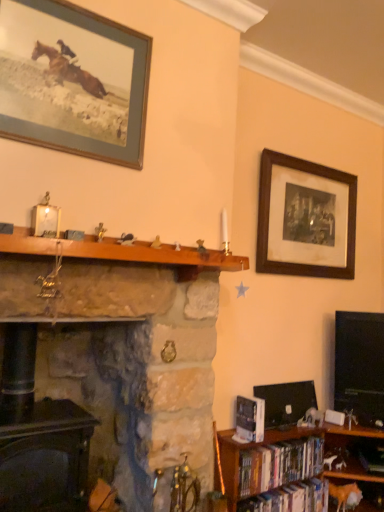
Question: In the image, is dark wood fireplace at lower left, positioned as the second fireplace in right-to-left order, positioned in front of or behind wooden bookshelf at lower right?

Choices:
 (A) front
 (B) behind

Answer: (B)

Question: Considering the relative positions of dark wood fireplace at lower left, positioned as the second fireplace in right-to-left order, and wooden bookshelf at lower right in the image provided, is dark wood fireplace at lower left, positioned as the second fireplace in right-to-left order, to the left or to the right of wooden bookshelf at lower right?

Choices:
 (A) right
 (B) left

Answer: (B)

Question: Which of these objects is positioned closest to the white glossy bookshelf at lower right, placed as the third book when sorted from bottom to top?

Choices:
 (A) wooden picture frame at upper right, the 1th picture frame in the right-to-left sequence
 (B) hardcover books at lower right, which ranks as the first book in bottom-to-top order
 (C) blue matte picture frame at upper left, which is counted as the 1th picture frame, starting from the left
 (D) dark wood fireplace at lower left, acting as the first fireplace starting from the left
 (E) wooden at center

Answer: (B)

Question: Estimate the real-world distances between objects in this image. Which object is farther from the wooden picture frame at upper right, placed as the 2th picture frame when sorted from left to right?

Choices:
 (A) dark wood fireplace at lower left, acting as the first fireplace starting from the left
 (B) white glossy bookshelf at lower right, which is the 1th book in top-to-bottom order
 (C) blue matte picture frame at upper left, which is counted as the 1th picture frame, starting from the left
 (D) black glossy flat-screen tv at right
 (E) hardcover books at lower right, which is the 2th book from bottom to top

Answer: (A)